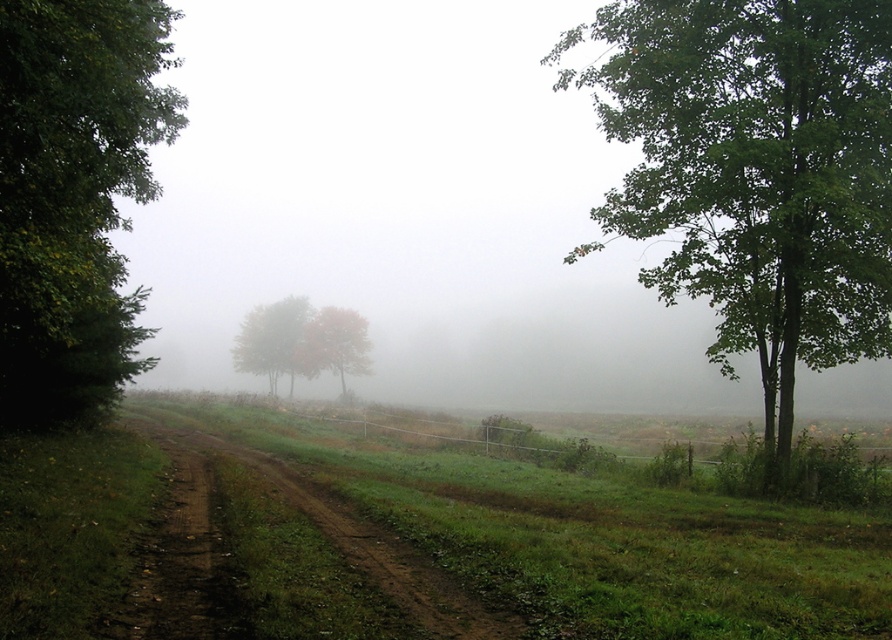
Is brown dirt track at center positioned at the back of autumn leaves tree at center?

No, it is not.

Which of these two, brown dirt track at center or autumn leaves tree at center, stands taller?

Standing taller between the two is autumn leaves tree at center.

Locate an element on the screen. brown dirt track at center is located at coordinates (288, 554).

Does green leafy tree at left have a lesser height compared to brown dirt track at center?

No.

Is point (141, 132) positioned after point (179, 561)?

That is True.

Find the location of a particular element. green leafy tree at left is located at coordinates (73, 196).

Is point (307, 316) positioned behind point (315, 330)?

Yes.

Is autumn leaves tree at center to the right of orange leafy tree at center from the viewer's perspective?

No, autumn leaves tree at center is not to the right of orange leafy tree at center.

At what (x,y) coordinates should I click in order to perform the action: click on autumn leaves tree at center. Please return your answer as a coordinate pair (x, y). The width and height of the screenshot is (892, 640). Looking at the image, I should click on (271, 339).